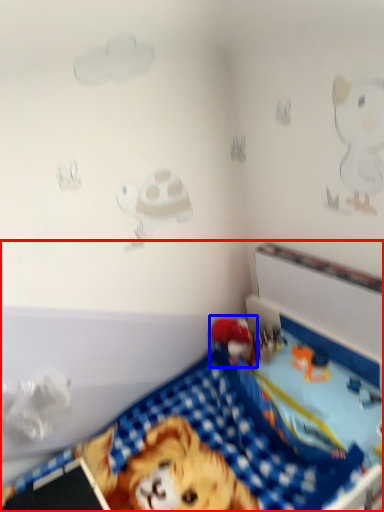
Question: Which of the following is the closest to the observer, toy (highlighted by a red box) or toy (highlighted by a blue box)?

Choices:
 (A) toy
 (B) toy

Answer: (A)